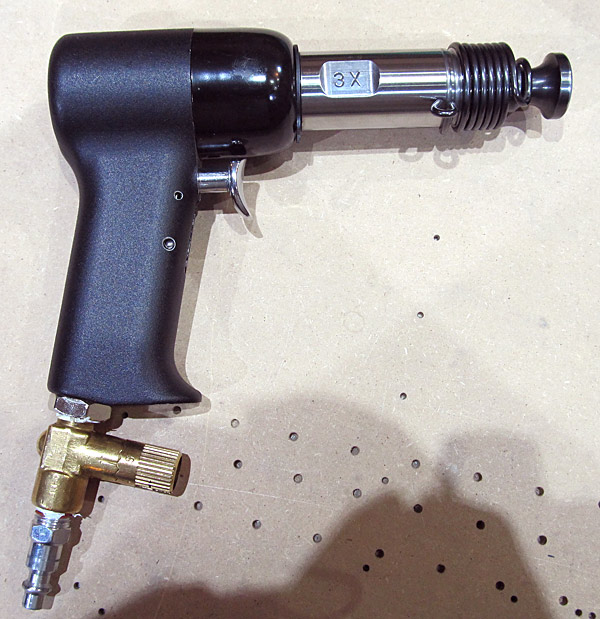
Locate an element on the screen. pegboard is located at coordinates (363, 361), (14, 488), (14, 170), (223, 163), (371, 15).